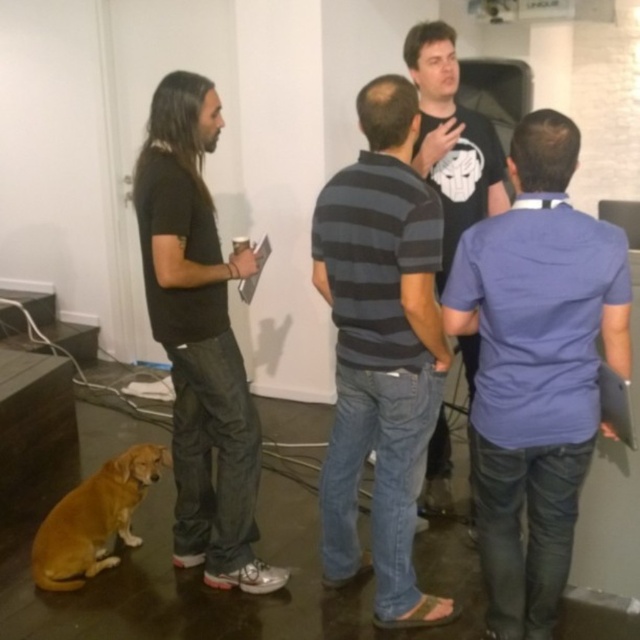
Question: Where is black cotton shirt at left located in relation to golden fur dog at lower left in the image?

Choices:
 (A) right
 (B) left

Answer: (A)

Question: Can you confirm if blue cotton shirt at right is smaller than golden fur dog at lower left?

Choices:
 (A) yes
 (B) no

Answer: (B)

Question: Which point is farther to the camera?

Choices:
 (A) (195, 372)
 (B) (35, 576)
 (C) (468, 157)
 (D) (548, 452)

Answer: (C)

Question: Which object is the closest to the golden fur dog at lower left?

Choices:
 (A) black cotton shirt at left
 (B) black matte t-shirt at center
 (C) striped cotton shirt at center

Answer: (A)

Question: Which point appears farthest from the camera in this image?

Choices:
 (A) (506, 310)
 (B) (106, 518)
 (C) (417, 90)
 (D) (358, 102)

Answer: (B)

Question: Does blue cotton shirt at right appear on the left side of black cotton shirt at left?

Choices:
 (A) yes
 (B) no

Answer: (B)